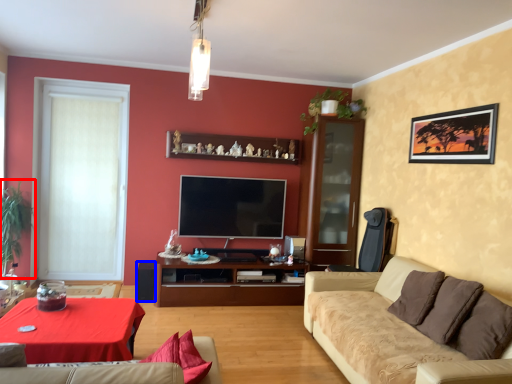
Question: Which object appears farthest to the camera in this image, plant (highlighted by a red box) or speaker (highlighted by a blue box)?

Choices:
 (A) plant
 (B) speaker

Answer: (B)